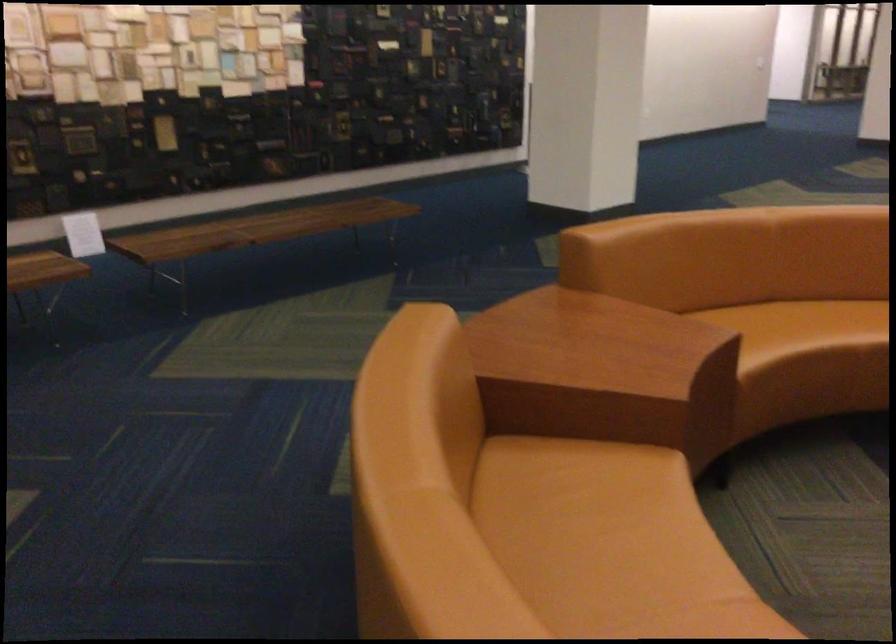
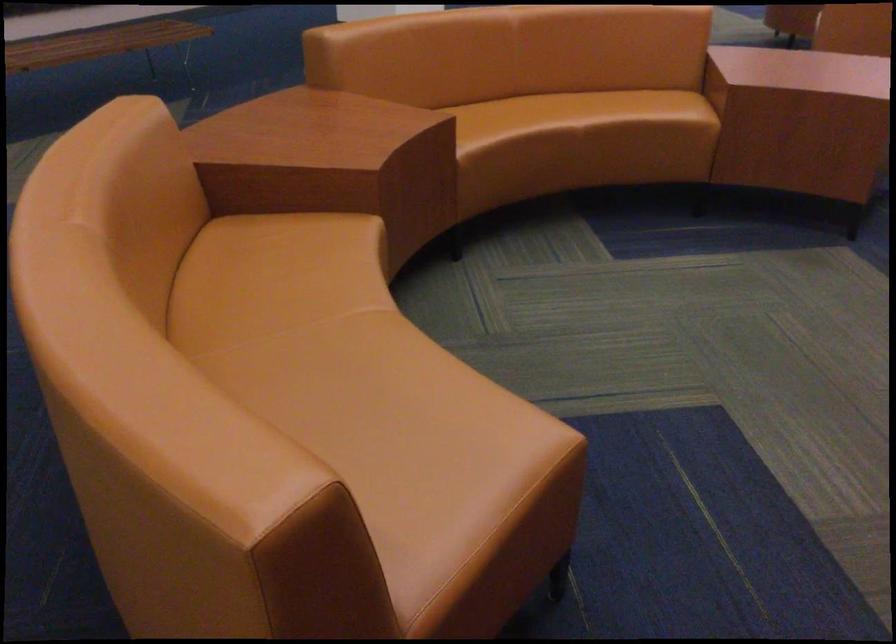
Find the pixel in the second image that matches [580,363] in the first image.

(297, 151)